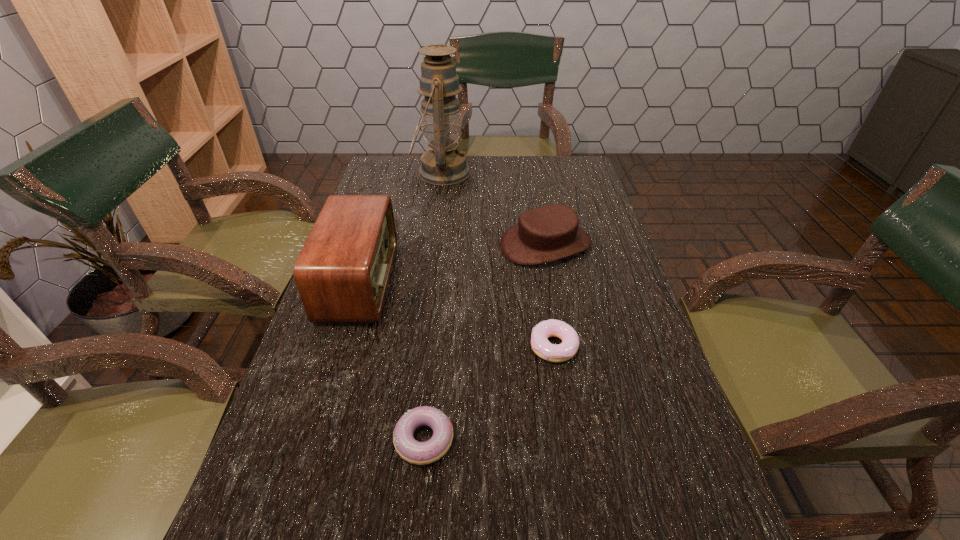
The width and height of the screenshot is (960, 540). I want to click on free spot between the hat and the nearer doughnut, so click(485, 342).

Locate which object ranks fourth in proximity to the hat. Please provide its 2D coordinates. Your answer should be formatted as a tuple, i.e. [(x, y)], where the tuple contains the x and y coordinates of a point satisfying the conditions above.

[(420, 453)]

Select which object appears as the closest to the oil lamp. Please provide its 2D coordinates. Your answer should be formatted as a tuple, i.e. [(x, y)], where the tuple contains the x and y coordinates of a point satisfying the conditions above.

[(549, 233)]

You are a GUI agent. You are given a task and a screenshot of the screen. Output one action in this format:
    pyautogui.click(x=<x>, y=<y>)
    Task: Click on the blank area in the image that satisfies the following two spatial constraints: 1. on the back side of the third tallest object; 2. on the right side of the second nearest object
    The image size is (960, 540).
    Given the screenshot: What is the action you would take?
    pyautogui.click(x=538, y=245)

The image size is (960, 540). I want to click on free space that satisfies the following two spatial constraints: 1. on the back side of the nearer doughnut; 2. on the front panel of the fourth shortest object, so click(x=441, y=281).

Image resolution: width=960 pixels, height=540 pixels. Find the location of `vacant region that satisfies the following two spatial constraints: 1. on the front panel of the second tallest object; 2. on the back side of the right doughnut`. vacant region that satisfies the following two spatial constraints: 1. on the front panel of the second tallest object; 2. on the back side of the right doughnut is located at coordinates (339, 346).

You are a GUI agent. You are given a task and a screenshot of the screen. Output one action in this format:
    pyautogui.click(x=<x>, y=<y>)
    Task: Click on the free region that satisfies the following two spatial constraints: 1. on the front panel of the radio receiver; 2. on the left side of the farther doughnut
    
    Given the screenshot: What is the action you would take?
    point(339,346)

Identify the location of blank area in the image that satisfies the following two spatial constraints: 1. on the front panel of the second tallest object; 2. on the back side of the left doughnut. (310, 440).

Where is `vacant space that satisfies the following two spatial constraints: 1. on the front panel of the fourth shortest object; 2. on the back side of the nearest object`? vacant space that satisfies the following two spatial constraints: 1. on the front panel of the fourth shortest object; 2. on the back side of the nearest object is located at coordinates [x=310, y=440].

You are a GUI agent. You are given a task and a screenshot of the screen. Output one action in this format:
    pyautogui.click(x=<x>, y=<y>)
    Task: Click on the free spot that satisfies the following two spatial constraints: 1. on the front panel of the fourth shortest object; 2. on the left side of the left doughnut
    
    Given the screenshot: What is the action you would take?
    pyautogui.click(x=310, y=440)